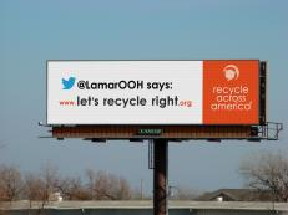
Identify the location of lamp. [40, 122].